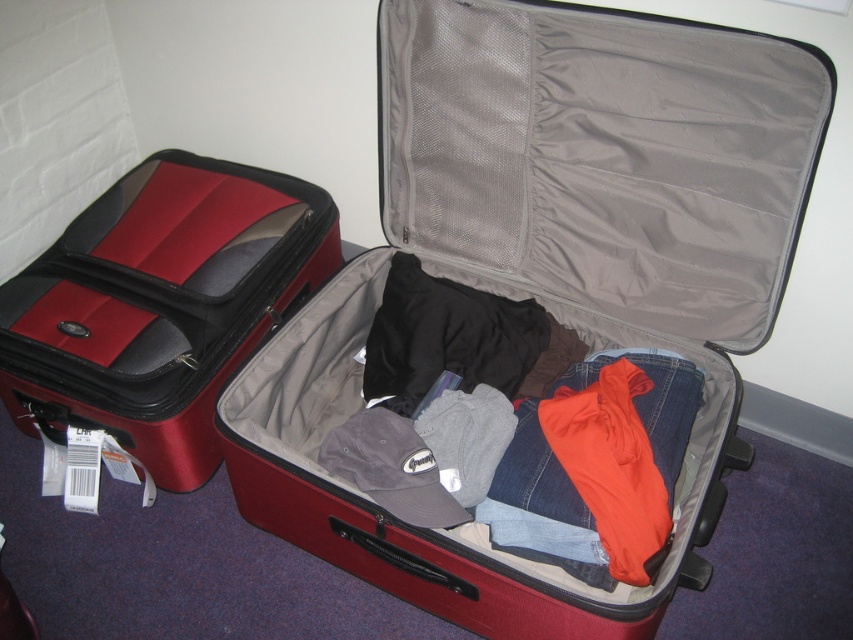
Between matte red suitcase at center and matte black suitcase at left, which one is positioned lower?

Positioned lower is matte red suitcase at center.

Who is taller, matte red suitcase at center or matte black suitcase at left?

matte red suitcase at center is taller.

Between point (796, 184) and point (119, 296), which one is positioned in front?

Positioned in front is point (796, 184).

What are the coordinates of `matte red suitcase at center` in the screenshot? It's located at point(547,262).

Is point (819, 122) more distant than point (556, 561)?

No, it is in front of (556, 561).

Who is more forward, (660, 170) or (578, 388)?

Point (660, 170) is in front.

Is point (395, 196) farther from viewer compared to point (654, 556)?

Yes, point (395, 196) is farther from viewer.

Find the location of a particular element. This screenshot has height=640, width=853. matte red suitcase at center is located at coordinates (547, 262).

Between matte black suitcase at left and denim jeans at center, which one appears on the left side from the viewer's perspective?

Positioned to the left is matte black suitcase at left.

Is point (165, 240) positioned in front of point (589, 445)?

That is False.

Who is more distant from viewer, (91, 419) or (613, 467)?

Point (91, 419)

The width and height of the screenshot is (853, 640). I want to click on matte black suitcase at left, so click(160, 305).